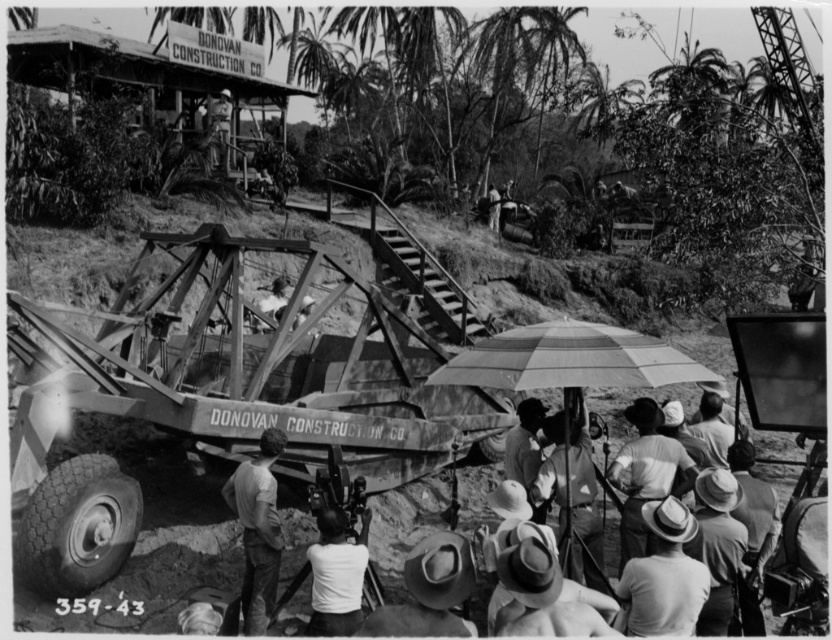
Image resolution: width=832 pixels, height=640 pixels. I want to click on light brown straw hat at center, so click(x=664, y=576).

Measure the distance between light brown straw hat at center and light gray cotton shirt at center.

light brown straw hat at center and light gray cotton shirt at center are 3.44 meters apart from each other.

Is point (697, 566) closer to camera compared to point (259, 624)?

Yes, it is in front of point (259, 624).

The image size is (832, 640). What are the coordinates of `light brown straw hat at center` in the screenshot? It's located at (664, 576).

What do you see at coordinates (221, 397) in the screenshot? I see `metallic construction equipment at center` at bounding box center [221, 397].

Could you measure the distance between metallic construction equipment at center and light brown straw hat at lower center?

metallic construction equipment at center is 4.83 meters from light brown straw hat at lower center.

Measure the distance between point (x=182, y=340) and camera.

The distance of point (x=182, y=340) from camera is 10.77 meters.

Image resolution: width=832 pixels, height=640 pixels. I want to click on metallic construction equipment at center, so click(x=221, y=397).

Is dark fabric shirt at center shorter than light brown wooden chair at upper center?

No.

Does dark fabric shirt at center appear under light brown wooden chair at upper center?

Yes.

Between point (528, 422) and point (489, 209), which one is positioned behind?

Point (489, 209)

The image size is (832, 640). Find the location of `dark fabric shirt at center`. dark fabric shirt at center is located at coordinates (526, 451).